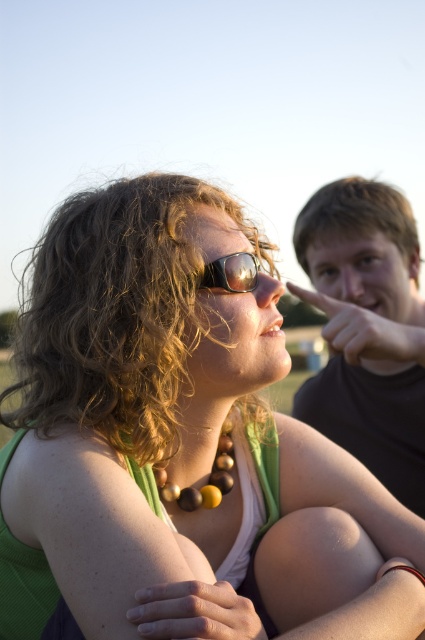
Question: Among these objects, which one is farthest from the camera?

Choices:
 (A) dark brown hair at upper right
 (B) green matte necklace at upper center
 (C) sunglasses at center

Answer: (A)

Question: In this image, where is green matte necklace at upper center located relative to sunglasses at center?

Choices:
 (A) right
 (B) left

Answer: (B)

Question: Can you confirm if green matte necklace at upper center is wider than sunglasses at center?

Choices:
 (A) no
 (B) yes

Answer: (B)

Question: Among these points, which one is nearest to the camera?

Choices:
 (A) (200, 289)
 (B) (61, 433)
 (C) (336, 401)

Answer: (B)

Question: Does green matte necklace at upper center appear on the left side of sunglasses at center?

Choices:
 (A) no
 (B) yes

Answer: (B)

Question: Considering the real-world distances, which object is closest to the green matte necklace at upper center?

Choices:
 (A) sunglasses at center
 (B) dark brown hair at upper right

Answer: (A)